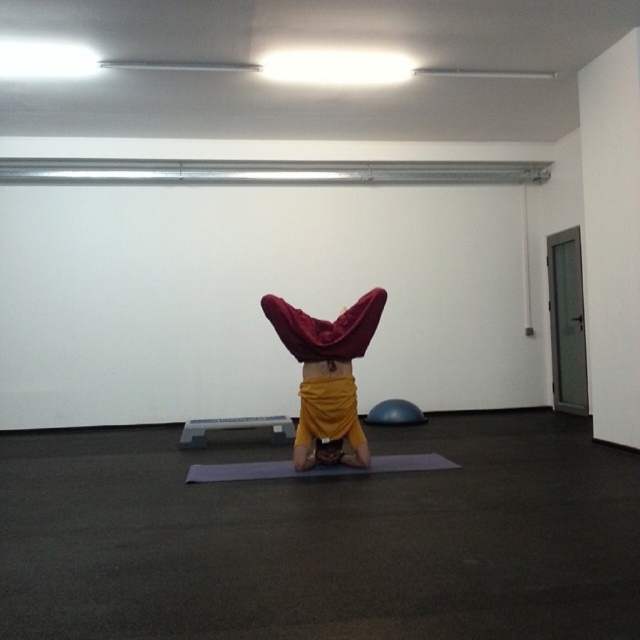
Question: Does velvet red cloth at center appear under gray rubber yoga mat at center?

Choices:
 (A) no
 (B) yes

Answer: (A)

Question: Where is gray rubber yoga mat at center located in relation to gray plastic lift at center in the image?

Choices:
 (A) below
 (B) above

Answer: (A)

Question: Which object appears farthest from the camera in this image?

Choices:
 (A) gray plastic lift at center
 (B) gray rubber yoga mat at center
 (C) velvet red cloth at center

Answer: (A)

Question: Is gray rubber yoga mat at center positioned at the back of gray plastic lift at center?

Choices:
 (A) yes
 (B) no

Answer: (B)

Question: Which of the following is the farthest from the observer?

Choices:
 (A) velvet red cloth at center
 (B) gray rubber yoga mat at center

Answer: (B)

Question: Which object is the farthest from the gray plastic lift at center?

Choices:
 (A) gray rubber yoga mat at center
 (B) velvet red cloth at center

Answer: (B)